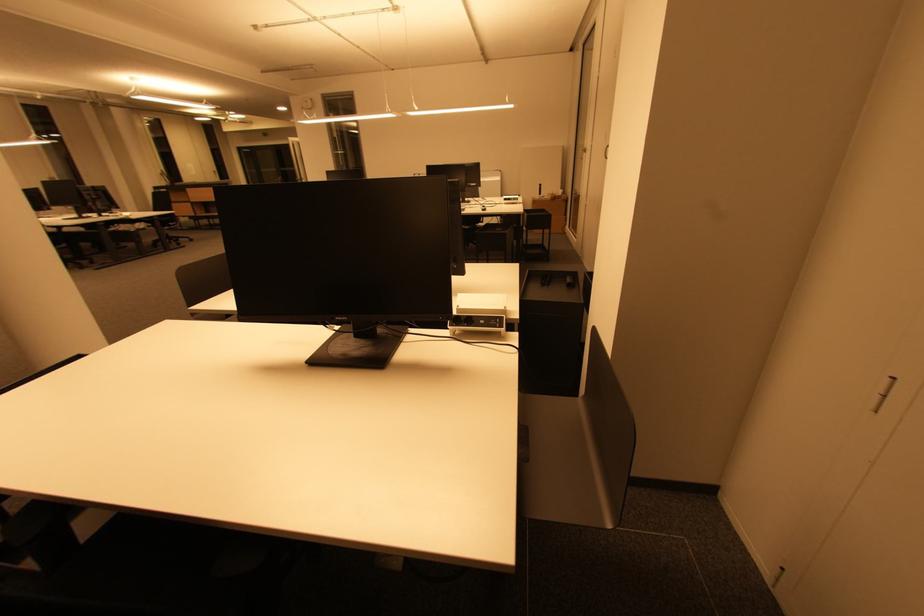
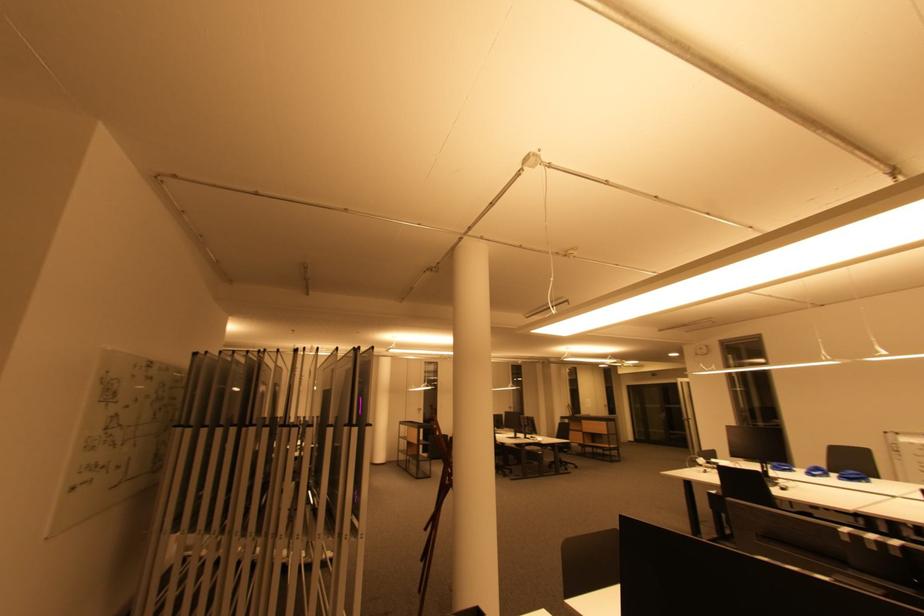
Looking at this image, based on the continuous images, in which direction is the camera rotating?

The camera's rotation is toward left-up.